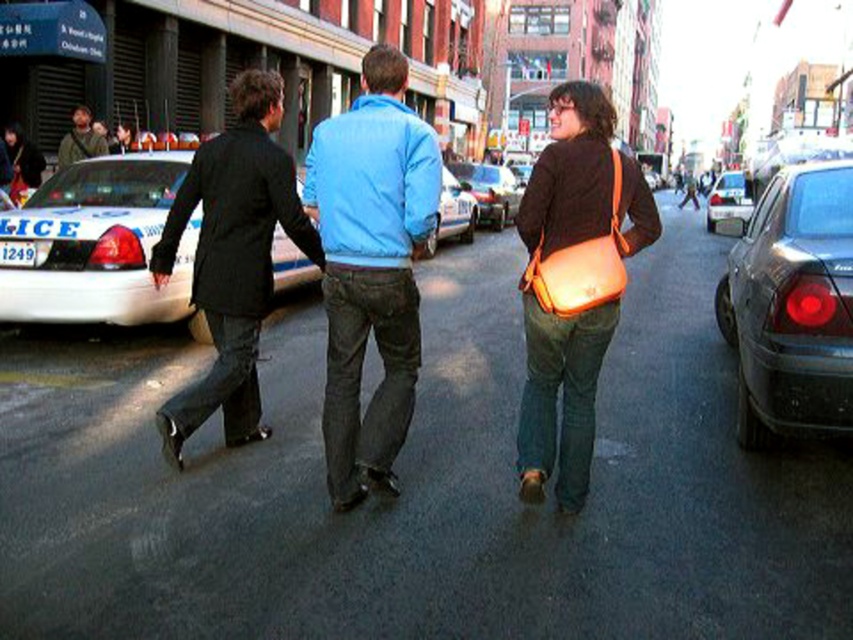
Question: Which object is the closest to the matte black jacket at left?

Choices:
 (A) white glossy police car at left
 (B) metallic blue sedan at center
 (C) blue denim jeans at center

Answer: (A)

Question: Is blue denim jeans at center above matte orange bag at center?

Choices:
 (A) no
 (B) yes

Answer: (B)

Question: Is white glossy police car at left further to camera compared to shiny silver sedan at center?

Choices:
 (A) no
 (B) yes

Answer: (A)

Question: Which is nearer to the matte black jacket at left?

Choices:
 (A) metallic silver sedan at center
 (B) black matte suit at left

Answer: (B)

Question: Which point is closer to the camera?

Choices:
 (A) metallic blue sedan at center
 (B) shiny black sedan at right

Answer: (A)

Question: Does blue denim jeans at center have a greater width compared to matte orange bag at center?

Choices:
 (A) no
 (B) yes

Answer: (A)